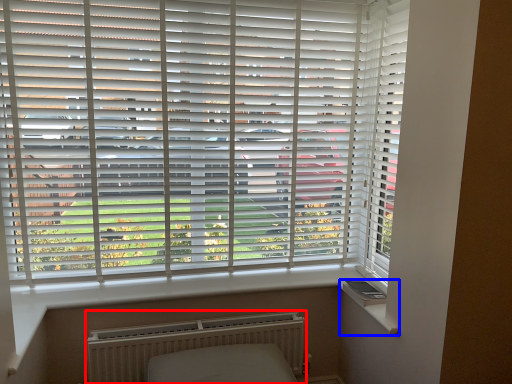
Question: Which of the following is the farthest to the observer, radiator (highlighted by a red box) or window sill (highlighted by a blue box)?

Choices:
 (A) radiator
 (B) window sill

Answer: (A)